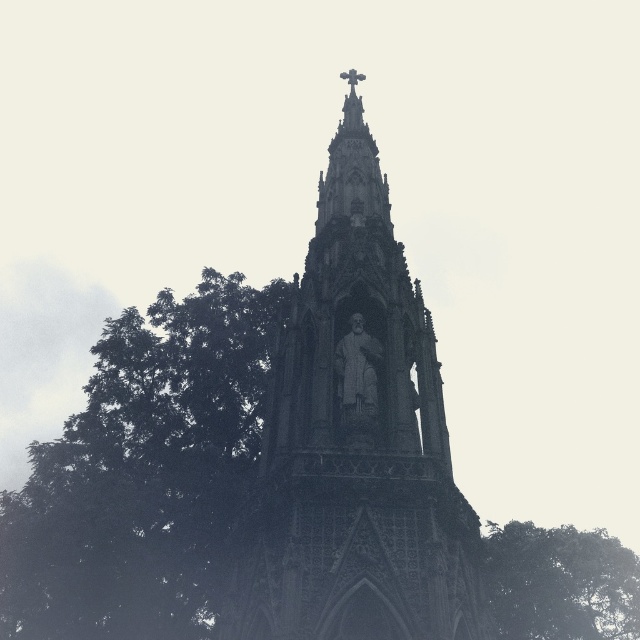
You are standing in front of the monument and want to take a photo. You notice two points on the monument marked as point 1 at coordinates point [332,369] and point 2 at coordinates point [637,625]. Which point is closer to you?

Point [332,369] is closer to the camera than point [637,625], so the point closer to you is point [332,369].

You are a visitor at the monument and want to take a photo that includes both the green leafy tree at left and the green leafy tree at lower right. Which tree should you move closer to in order to include both in the frame without cropping?

To include both the green leafy tree at left and the green leafy tree at lower right in the frame without cropping, you should move closer to the green leafy tree at lower right since it is smaller and requires less space in the photo.